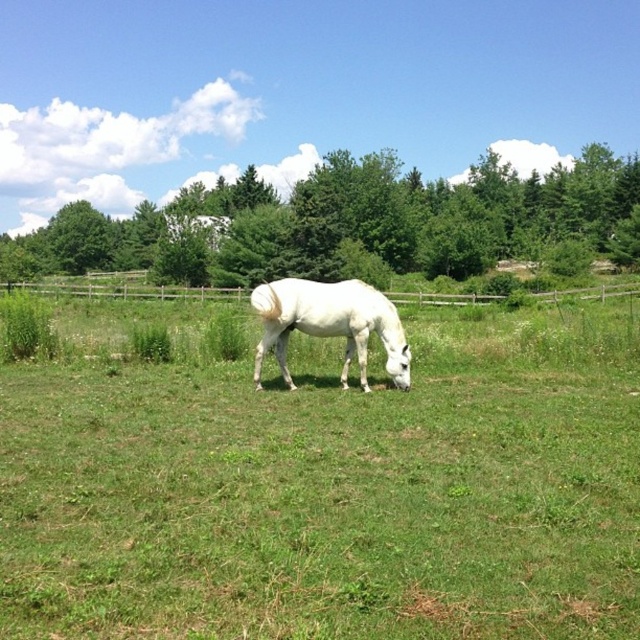
You are a photographer positioned at the center of the field. You want to take a photo of the white glossy horse at center and the wooden fence at center. Which object is closer to your current position?

The white glossy horse at center is to the right of wooden fence at center, so the wooden fence at center is closer to your current position at the field center.